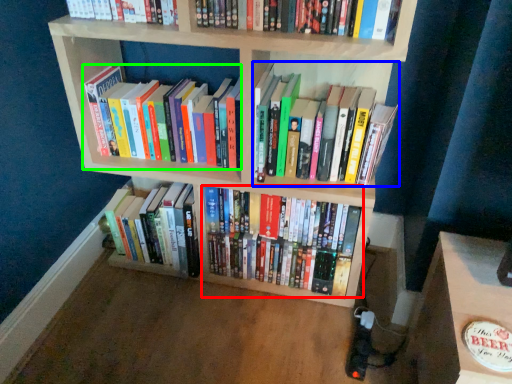
Question: Which object is positioned closest to book (highlighted by a red box)? Select from book (highlighted by a blue box) and book (highlighted by a green box).

Choices:
 (A) book
 (B) book

Answer: (B)